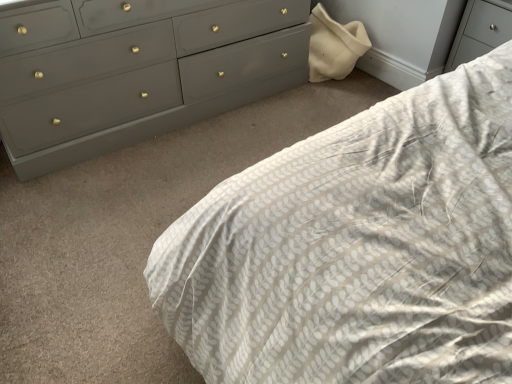
Question: From their relative heights in the image, would you say matte gray dresser at upper left is taller or shorter than white textured fabric at center?

Choices:
 (A) short
 (B) tall

Answer: (A)

Question: Would you say matte gray dresser at upper left is inside or outside white textured fabric at center?

Choices:
 (A) outside
 (B) inside

Answer: (A)

Question: From a real-world perspective, is matte gray dresser at upper left positioned above or below white textured fabric at center?

Choices:
 (A) above
 (B) below

Answer: (B)

Question: Would you say white textured fabric at center is inside or outside matte gray dresser at upper left?

Choices:
 (A) outside
 (B) inside

Answer: (A)

Question: Based on their positions, is white textured fabric at center located to the left or right of matte gray dresser at upper left?

Choices:
 (A) left
 (B) right

Answer: (B)

Question: Is point (484, 221) closer or farther from the camera than point (286, 31)?

Choices:
 (A) closer
 (B) farther

Answer: (A)

Question: Considering the positions of white textured fabric at center and matte gray dresser at upper left in the image, is white textured fabric at center wider or thinner than matte gray dresser at upper left?

Choices:
 (A) wide
 (B) thin

Answer: (A)